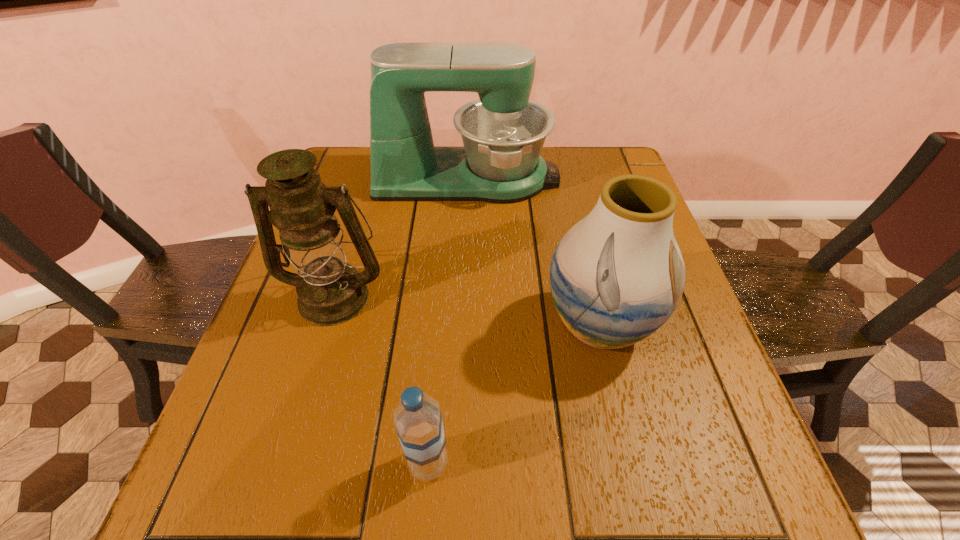
Find the location of a particular element. the farthest object is located at coordinates (503, 133).

Identify the location of oil lamp. pos(330,291).

Identify the location of vase. The height and width of the screenshot is (540, 960). (616, 276).

Where is `the nearest object`? This screenshot has width=960, height=540. the nearest object is located at coordinates (418, 421).

Locate an element on the screen. The width and height of the screenshot is (960, 540). the shortest object is located at coordinates (418, 421).

Find the location of a particular element. The height and width of the screenshot is (540, 960). vacant space located on the front-facing side of the farthest object is located at coordinates (587, 178).

This screenshot has height=540, width=960. I want to click on vacant space located on the front of the oil lamp, so (287, 454).

Locate an element on the screen. free region located on the left of the vase is located at coordinates (x=508, y=326).

At what (x,y) coordinates should I click in order to perform the action: click on vacant region located on the label of the nearest object. Please return your answer as a coordinate pair (x, y). Looking at the image, I should click on (517, 463).

Locate an element on the screen. object located in the far edge section of the desktop is located at coordinates (503, 133).